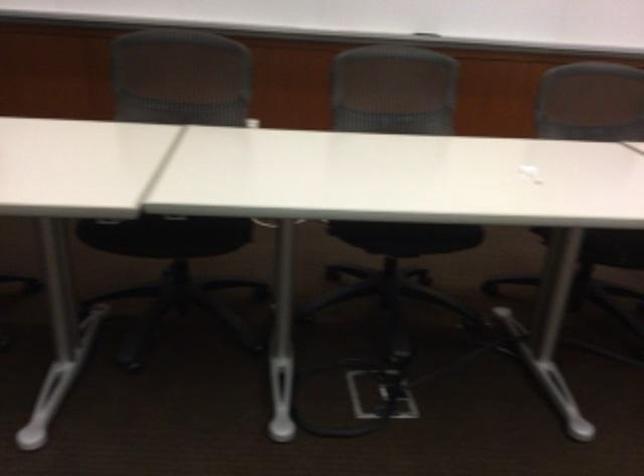
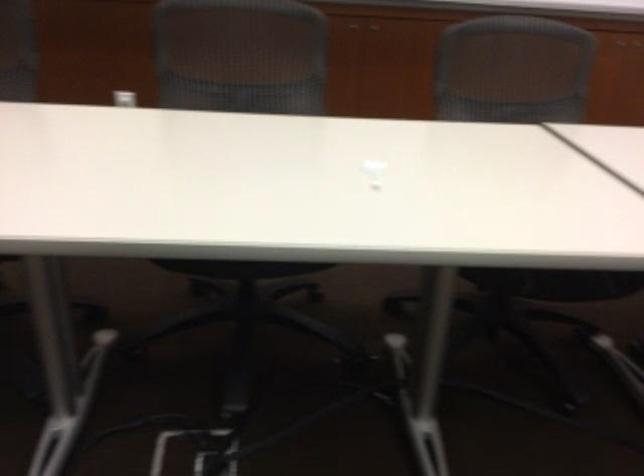
In the second image, find the point that corresponds to the point at 252,120 in the first image.

(125, 96)